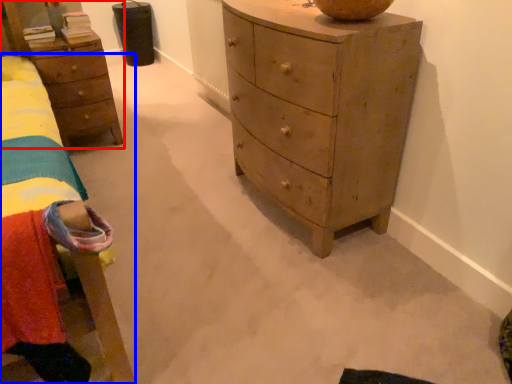
Question: Which object is further to the camera taking this photo, nightstand (highlighted by a red box) or bed (highlighted by a blue box)?

Choices:
 (A) nightstand
 (B) bed

Answer: (A)